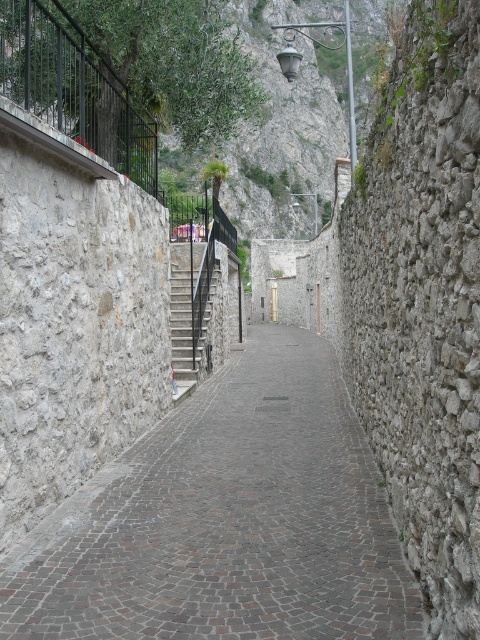
Question: Which of the following is the farthest from the observer?

Choices:
 (A) (291, 355)
 (B) (85, 49)
 (C) (179, 364)

Answer: (A)

Question: Can you confirm if brown cobblestone pavement at center is thinner than black metal railing at upper left?

Choices:
 (A) no
 (B) yes

Answer: (A)

Question: From the image, what is the correct spatial relationship of brown cobblestone pavement at center in relation to dark gray stone stairs at center?

Choices:
 (A) above
 (B) below

Answer: (B)

Question: Which point is farther from the camera taking this photo?

Choices:
 (A) (88, 88)
 (B) (197, 362)

Answer: (B)

Question: Based on their relative distances, which object is nearer to the black metal railing at upper left?

Choices:
 (A) dark gray stone stairs at center
 (B) brown cobblestone pavement at center

Answer: (A)

Question: In this image, where is black metal railing at upper left located relative to dark gray stone stairs at center?

Choices:
 (A) below
 (B) above

Answer: (B)